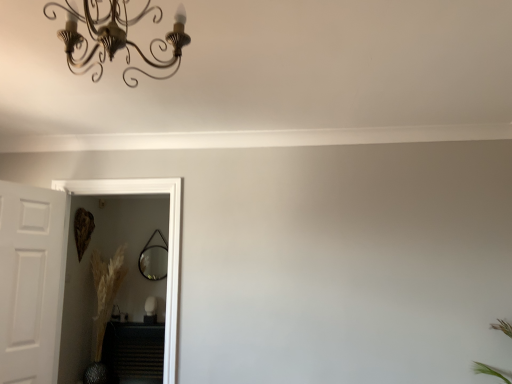
Question: From a real-world perspective, is white matte door at left below black matte radiator at lower left?

Choices:
 (A) no
 (B) yes

Answer: (A)

Question: Is white matte door at left far from black matte radiator at lower left?

Choices:
 (A) no
 (B) yes

Answer: (B)

Question: Would you say white matte door at left is outside black matte radiator at lower left?

Choices:
 (A) yes
 (B) no

Answer: (A)

Question: Could you tell me if white matte door at left is facing black matte radiator at lower left?

Choices:
 (A) yes
 (B) no

Answer: (B)

Question: Is white matte door at left oriented away from black matte radiator at lower left?

Choices:
 (A) yes
 (B) no

Answer: (B)

Question: From a real-world perspective, is matte black mirror at center positioned above or below clear glass door at left?

Choices:
 (A) above
 (B) below

Answer: (A)

Question: Is matte black mirror at center inside the boundaries of clear glass door at left, or outside?

Choices:
 (A) outside
 (B) inside

Answer: (A)

Question: In terms of size, does matte black mirror at center appear bigger or smaller than clear glass door at left?

Choices:
 (A) big
 (B) small

Answer: (B)

Question: Considering their positions, is matte black mirror at center located in front of or behind clear glass door at left?

Choices:
 (A) behind
 (B) front

Answer: (A)

Question: From a real-world perspective, is matte black mirror at center above or below white matte door at left?

Choices:
 (A) above
 (B) below

Answer: (A)

Question: Is matte black mirror at center wider or thinner than white matte door at left?

Choices:
 (A) wide
 (B) thin

Answer: (B)

Question: Considering the relative positions of matte black mirror at center and white matte door at left in the image provided, is matte black mirror at center to the left or to the right of white matte door at left?

Choices:
 (A) right
 (B) left

Answer: (A)

Question: From the image's perspective, is matte black mirror at center located above or below white matte door at left?

Choices:
 (A) above
 (B) below

Answer: (B)

Question: In terms of width, does silvery metallic vase at lower left look wider or thinner when compared to matte black mirror at center?

Choices:
 (A) wide
 (B) thin

Answer: (A)

Question: Looking at the image, does silvery metallic vase at lower left seem bigger or smaller compared to matte black mirror at center?

Choices:
 (A) small
 (B) big

Answer: (B)